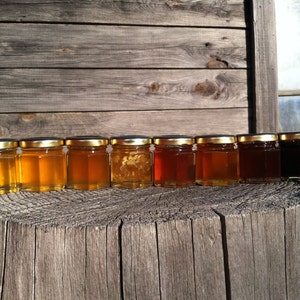
Where is `wooden planks`? wooden planks is located at coordinates (113, 87), (129, 45).